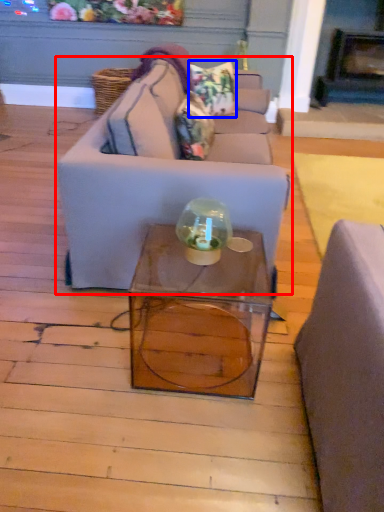
Question: Which object appears farthest to the camera in this image, studio couch (highlighted by a red box) or pillow (highlighted by a blue box)?

Choices:
 (A) studio couch
 (B) pillow

Answer: (B)